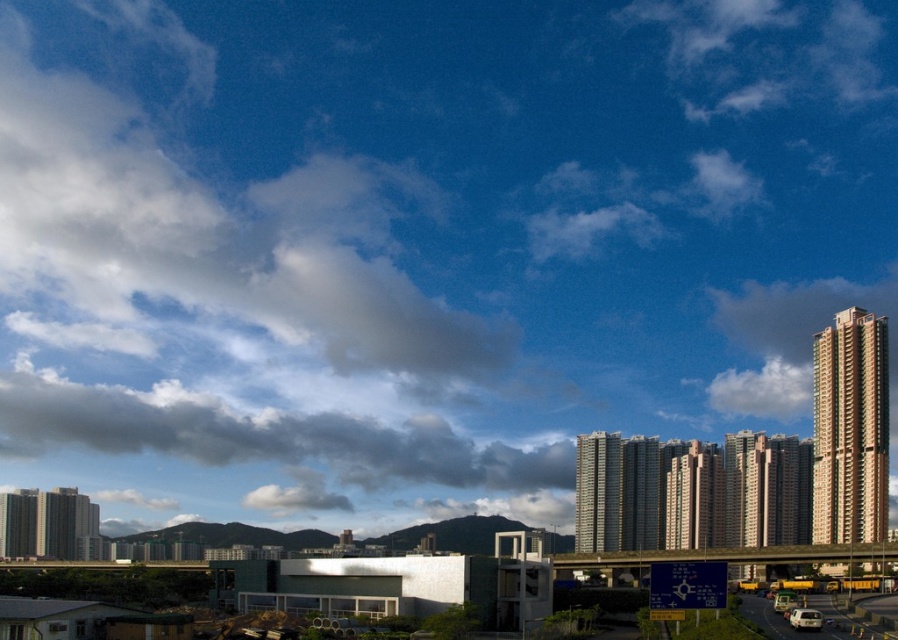
Is dark gray cloud at upper left to the left of greenish-brown concrete building at right from the viewer's perspective?

Correct, you'll find dark gray cloud at upper left to the left of greenish-brown concrete building at right.

Does dark gray cloud at upper left have a greater height compared to greenish-brown concrete building at right?

Indeed, dark gray cloud at upper left has a greater height compared to greenish-brown concrete building at right.

Between point (340, 454) and point (860, 356), which one is positioned behind?

The point (340, 454) is more distant.

At what (x,y) coordinates should I click in order to perform the action: click on dark gray cloud at upper left. Please return your answer as a coordinate pair (x, y). The image size is (898, 640). Looking at the image, I should click on (263, 448).

Does metallic gray overpass at center appear under gray concrete building at center?

Yes, metallic gray overpass at center is below gray concrete building at center.

Does metallic gray overpass at center appear on the left side of gray concrete building at center?

In fact, metallic gray overpass at center is to the right of gray concrete building at center.

Is point (832, 552) positioned after point (584, 545)?

No, it is in front of (584, 545).

Identify the location of metallic gray overpass at center. The height and width of the screenshot is (640, 898). (731, 556).

From the picture: Can you confirm if greenish-brown concrete building at right is taller than metallic gray overpass at center?

Yes.

Which is above, greenish-brown concrete building at right or metallic gray overpass at center?

greenish-brown concrete building at right

Is point (825, 451) more distant than point (794, 563)?

Yes, it is.

Find the location of a particular element. The width and height of the screenshot is (898, 640). greenish-brown concrete building at right is located at coordinates (850, 428).